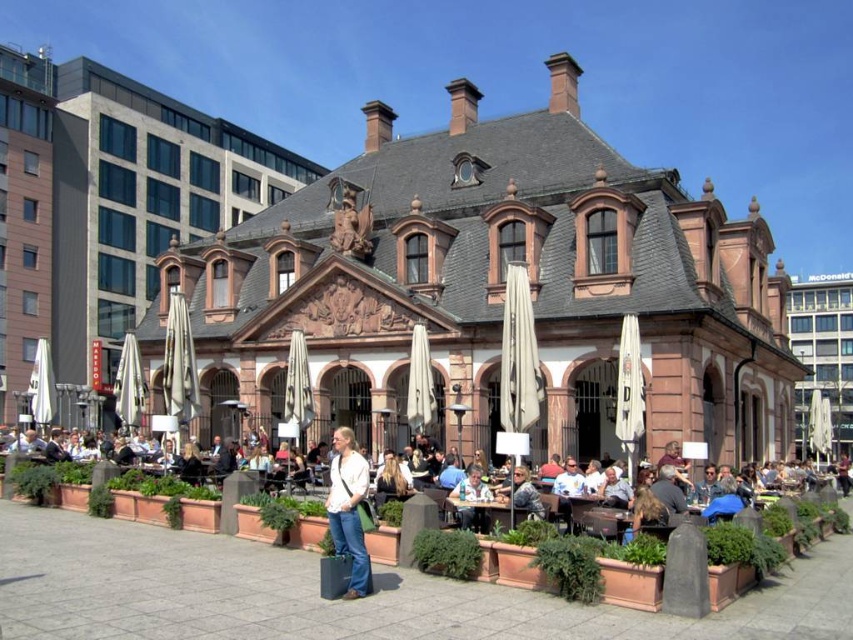
You are standing at the entrance of the historic building and want to reach both the denim jeans at center and the denim jacket at lower center. Which item is closer to you?

The denim jacket at lower center is closer to you because it is located at a lower position compared to the denim jeans at center, which is farther away.

You are a customer at the outdoor cafe and want to place your denim jacket at lower center on the wooden table at center. Can you do this without moving any other items?

The wooden table at center is located below denim jacket at lower center, so the denim jacket at lower center is already positioned above the wooden table at center. Therefore, you can place it there without moving other items.